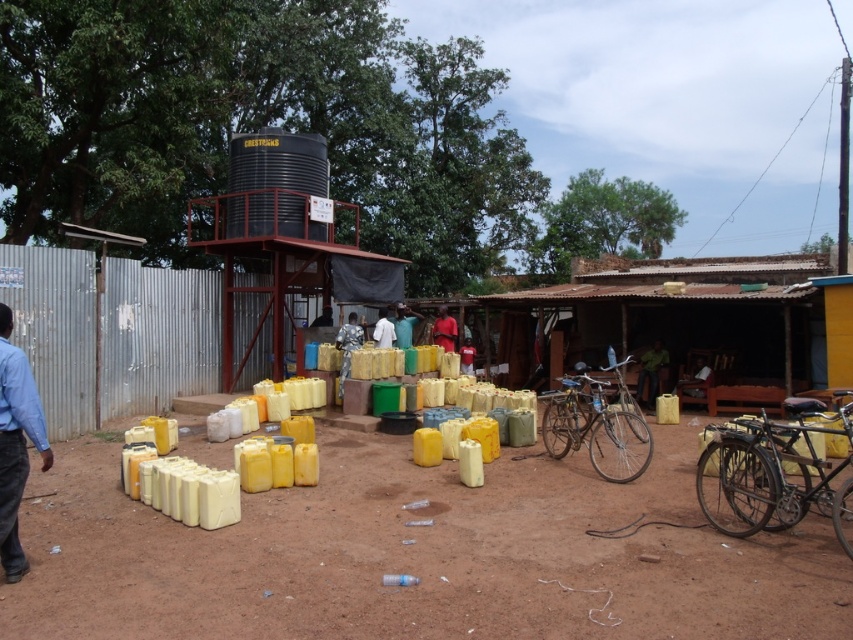
Is matte red shirt at center thinner than white matte shirt at center?

In fact, matte red shirt at center might be wider than white matte shirt at center.

Who is lower down, matte red shirt at center or white matte shirt at center?

matte red shirt at center

Is point (444, 339) farther from camera compared to point (376, 328)?

That is True.

Locate an element on the screen. matte red shirt at center is located at coordinates (444, 330).

Which is behind, point (7, 456) or point (380, 339)?

The point (380, 339) is more distant.

Is blue shirt at left shorter than white matte shirt at center?

No, blue shirt at left is not shorter than white matte shirt at center.

Is point (3, 323) positioned in front of point (384, 346)?

Yes, point (3, 323) is closer to viewer.

You are a GUI agent. You are given a task and a screenshot of the screen. Output one action in this format:
    pyautogui.click(x=<x>, y=<y>)
    Task: Click on the blue shirt at left
    This screenshot has height=640, width=853.
    Given the screenshot: What is the action you would take?
    pyautogui.click(x=15, y=444)

Can you confirm if brown dirt field at center is thinner than blue fabric at center?

Incorrect, brown dirt field at center's width is not less than blue fabric at center's.

Between brown dirt field at center and blue fabric at center, which one is positioned higher?

blue fabric at center is above.

Where is `brown dirt field at center`? The width and height of the screenshot is (853, 640). brown dirt field at center is located at coordinates (421, 556).

I want to click on brown dirt field at center, so 421,556.